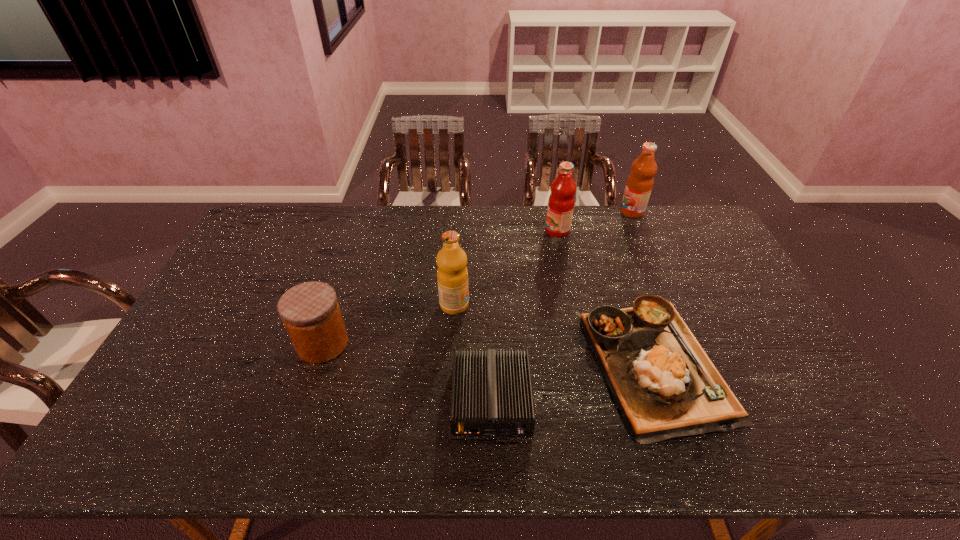
The height and width of the screenshot is (540, 960). Find the location of `vacant space that is in between the router and the jar`. vacant space that is in between the router and the jar is located at coordinates (407, 372).

I want to click on free spot between the second farthest object and the leftmost fruit juice, so click(x=506, y=268).

Find the location of a particular element. This screenshot has height=540, width=960. vacant area between the second fruit juice from right to left and the platter is located at coordinates coord(606,297).

At what (x,y) coordinates should I click in order to perform the action: click on empty location between the fifth nearest object and the platter. Please return your answer as a coordinate pair (x, y). The width and height of the screenshot is (960, 540). Looking at the image, I should click on (606, 297).

Identify which object is the second nearest to the router. Please provide its 2D coordinates. Your answer should be formatted as a tuple, i.e. [(x, y)], where the tuple contains the x and y coordinates of a point satisfying the conditions above.

[(452, 275)]

Identify which object is the second nearest to the second fruit juice from left to right. Please provide its 2D coordinates. Your answer should be formatted as a tuple, i.e. [(x, y)], where the tuple contains the x and y coordinates of a point satisfying the conditions above.

[(665, 385)]

What are the coordinates of `the second closest fruit juice to the second farthest fruit juice` in the screenshot? It's located at (452, 275).

At what (x,y) coordinates should I click in order to perform the action: click on fruit juice object that ranks as the closest to the second fruit juice from left to right. Please return your answer as a coordinate pair (x, y). The width and height of the screenshot is (960, 540). Looking at the image, I should click on (639, 184).

Where is `free region that satisfies the following two spatial constraints: 1. on the front label of the fifth nearest object; 2. on the left side of the platter`? This screenshot has height=540, width=960. free region that satisfies the following two spatial constraints: 1. on the front label of the fifth nearest object; 2. on the left side of the platter is located at coordinates (586, 363).

What are the coordinates of `free region that satisfies the following two spatial constraints: 1. on the back side of the platter; 2. on the front label of the nearest fruit juice` in the screenshot? It's located at (634, 305).